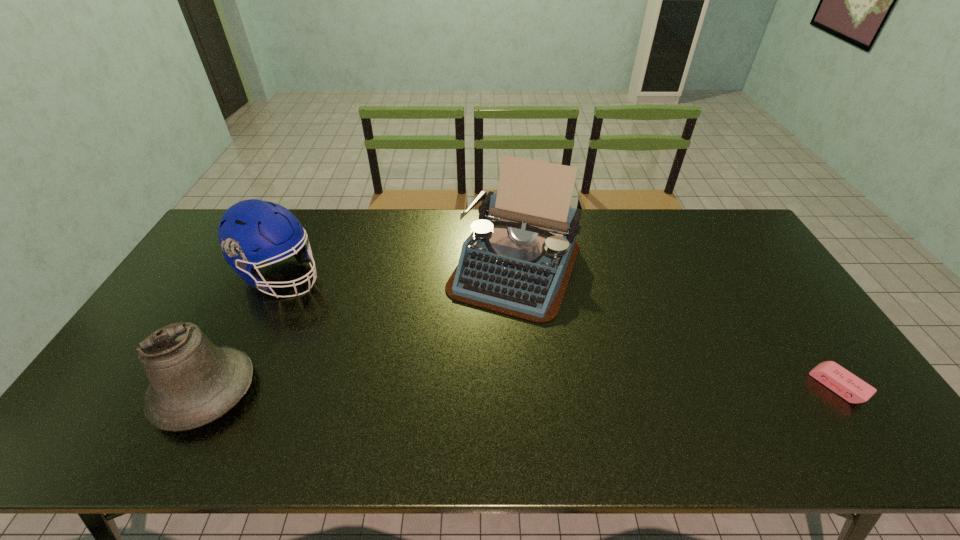
Identify the location of empty location between the football helmet and the typewriter. The image size is (960, 540). (398, 271).

You are a GUI agent. You are given a task and a screenshot of the screen. Output one action in this format:
    pyautogui.click(x=<x>, y=<y>)
    Task: Click on the free space between the bell and the typewriter
    
    Given the screenshot: What is the action you would take?
    pyautogui.click(x=360, y=329)

At what (x,y) coordinates should I click in order to perform the action: click on free spot between the football helmet and the rightmost object. Please return your answer as a coordinate pair (x, y). Looking at the image, I should click on (560, 330).

Locate an element on the screen. Image resolution: width=960 pixels, height=540 pixels. vacant area that lies between the bell and the football helmet is located at coordinates (243, 333).

Locate an element on the screen. The image size is (960, 540). blank region between the shortest object and the football helmet is located at coordinates (560, 330).

The image size is (960, 540). I want to click on object that stands as the second closest to the bell, so click(518, 260).

Identify the location of object that ranks as the closest to the typewriter. The width and height of the screenshot is (960, 540). (249, 225).

You are a GUI agent. You are given a task and a screenshot of the screen. Output one action in this format:
    pyautogui.click(x=<x>, y=<y>)
    Task: Click on the free space in the image that satisfies the following two spatial constraints: 1. on the front side of the second object from right to left; 2. on the left side of the rightmost object
    This screenshot has height=540, width=960.
    Given the screenshot: What is the action you would take?
    pyautogui.click(x=526, y=386)

Locate an element on the screen. Image resolution: width=960 pixels, height=540 pixels. vacant position in the image that satisfies the following two spatial constraints: 1. on the back side of the football helmet; 2. on the right side of the bell is located at coordinates (266, 275).

This screenshot has width=960, height=540. What are the coordinates of `free region that satisfies the following two spatial constraints: 1. on the front side of the typewriter; 2. on the left side of the eraser` in the screenshot? It's located at (526, 386).